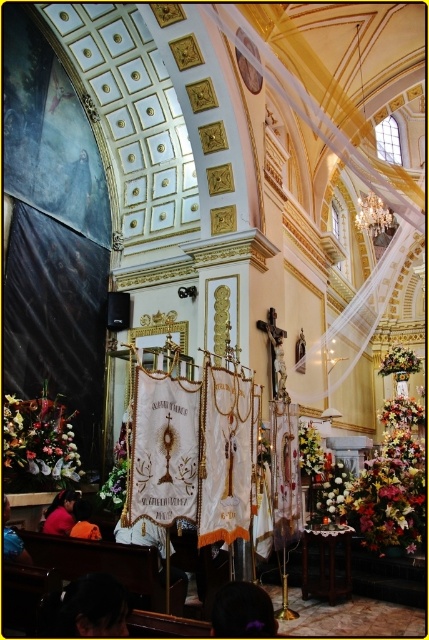
You are a visitor standing at the entrance of the grand church and see the floral bouquet at lower left and the green leafy plant at center. Which object is closer to you?

The floral bouquet at lower left is closer to you since it is only 21.28 meters away from the green leafy plant at center, implying it is nearer to the entrance.

You are standing in the grand church and notice both the green leafy plant at center and the floral bouquet at center. Which one appears nearer to you?

The green leafy plant at center is closer to the viewer than the floral bouquet at center.

You are attending a ceremony in the church and notice the floral bouquet at lower left and the green leafy plant at center. Which of these two items is positioned higher from the ground?

The floral bouquet at lower left is located above the green leafy plant at center, so it is positioned higher from the ground.